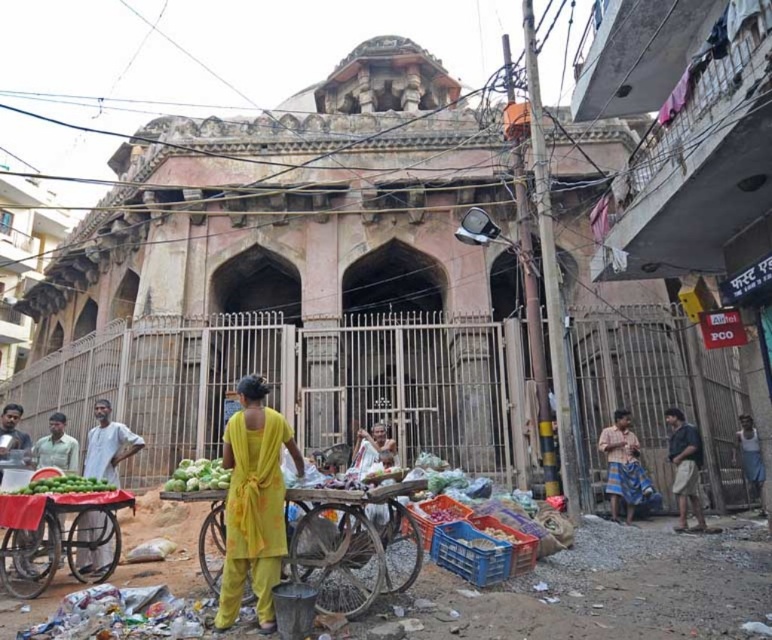
Looking at this image, you are standing at the center of the street in front of the historical building. You need to find the light gray cotton shirt at lower left. In which direction should you look to locate it?

The light gray cotton shirt at lower left is located at point (107, 444), which corresponds to the lower left direction from your current position at the center of the street.

You are a delivery person standing at the entrance of the historical building. You need to place a package that is 1.5 meters long between the light gray cotton shirt at lower left and the green matte limes at lower left. Is there enough space?

The distance between the light gray cotton shirt at lower left and the green matte limes at lower left is 1.37 meters. Since the package is 1.5 meters long, it will not fit in the available space.